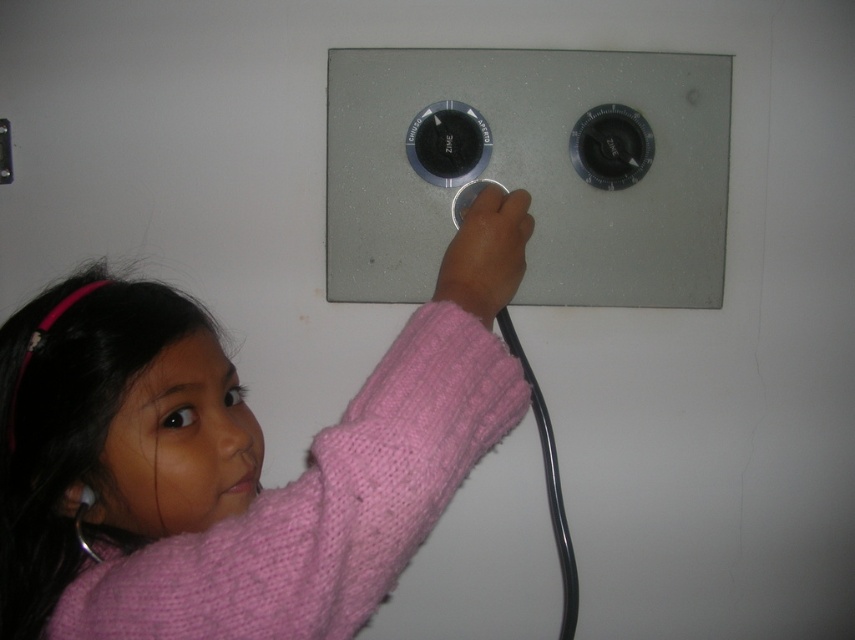
Question: Based on their relative distances, which object is nearer to the matte pink sweater at center?

Choices:
 (A) black plastic knob at center
 (B) matte black knob at upper right

Answer: (A)

Question: Can you confirm if pink knitted sweater at upper center is positioned below satin silver knobs at center?

Choices:
 (A) no
 (B) yes

Answer: (B)

Question: Does black plastic knob at center appear on the left side of matte black knob at upper right?

Choices:
 (A) yes
 (B) no

Answer: (A)

Question: Among these points, which one is farthest from the camera?

Choices:
 (A) (469, 253)
 (B) (475, 152)
 (C) (635, 112)

Answer: (C)

Question: Considering the relative positions of matte pink sweater at center and matte black knob at center in the image provided, where is matte pink sweater at center located with respect to matte black knob at center?

Choices:
 (A) above
 (B) below

Answer: (B)

Question: Which of the following is the farthest from the observer?

Choices:
 (A) (553, 292)
 (B) (234, 516)
 (C) (582, 122)
 (D) (460, 108)

Answer: (A)